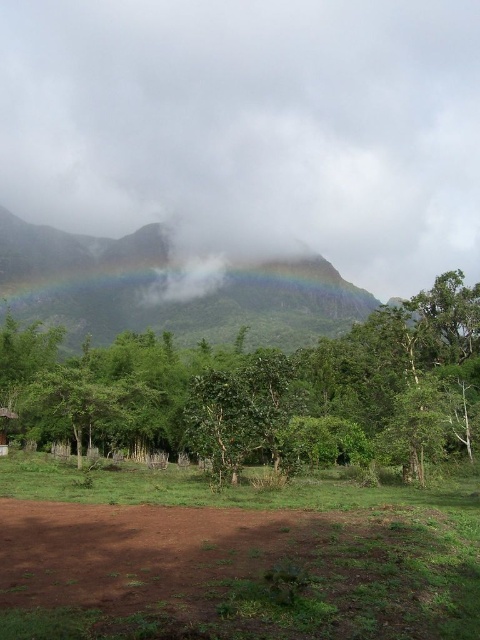
You are planning to build a small shed in this area. You notice the green leafy tree at center and the brown wooden hut at lower left. Which of these two structures is larger in size?

The green leafy tree at center is bigger than the brown wooden hut at lower left, so the tree is larger in size.

You are a hiker trying to navigate through the forest depicted in the image. You see two points marked as point (434, 80) and point (244, 561). Which point is closer to your current position?

Point (434, 80) is further to the viewer than point (244, 561), so the closer point to your current position is point (244, 561).